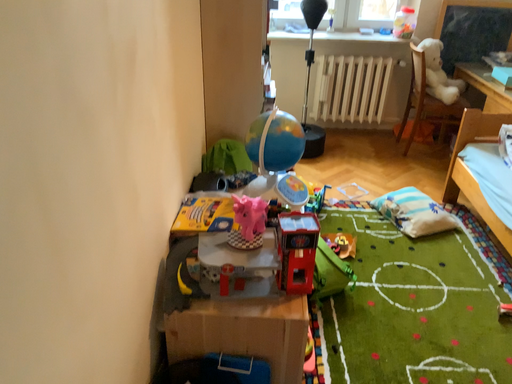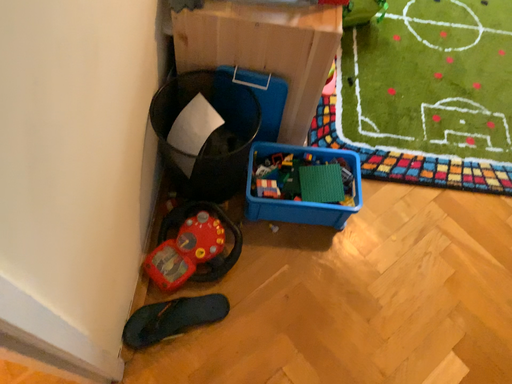
Question: How did the camera likely rotate when shooting the video?

Choices:
 (A) rotated downward
 (B) rotated upward

Answer: (A)